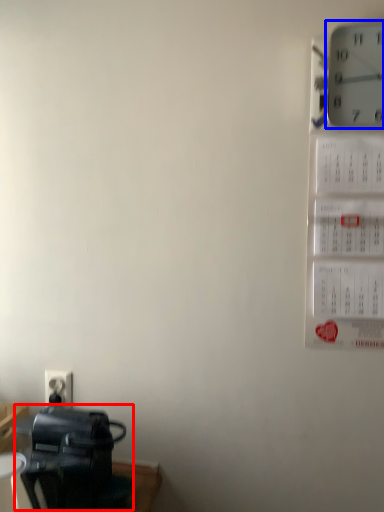
Question: Among these objects, which one is farthest to the camera, appliance (highlighted by a red box) or wall clock (highlighted by a blue box)?

Choices:
 (A) appliance
 (B) wall clock

Answer: (A)